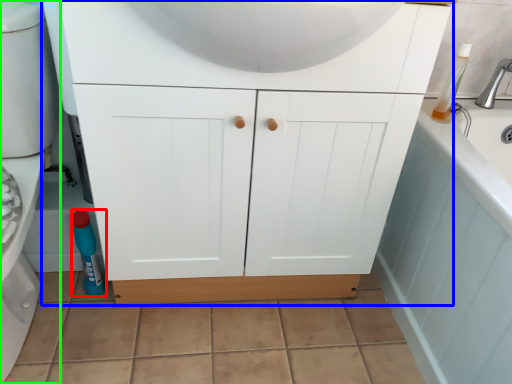
Question: Considering the real-world distances, which object is farthest from bottle (highlighted by a red box)? bathroom cabinet (highlighted by a blue box) or porcelain (highlighted by a green box)?

Choices:
 (A) bathroom cabinet
 (B) porcelain

Answer: (A)